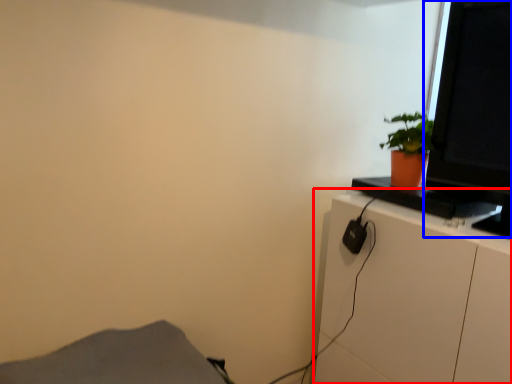
Question: Which object is further to the camera taking this photo, cabinetry (highlighted by a red box) or computer monitor (highlighted by a blue box)?

Choices:
 (A) cabinetry
 (B) computer monitor

Answer: (B)